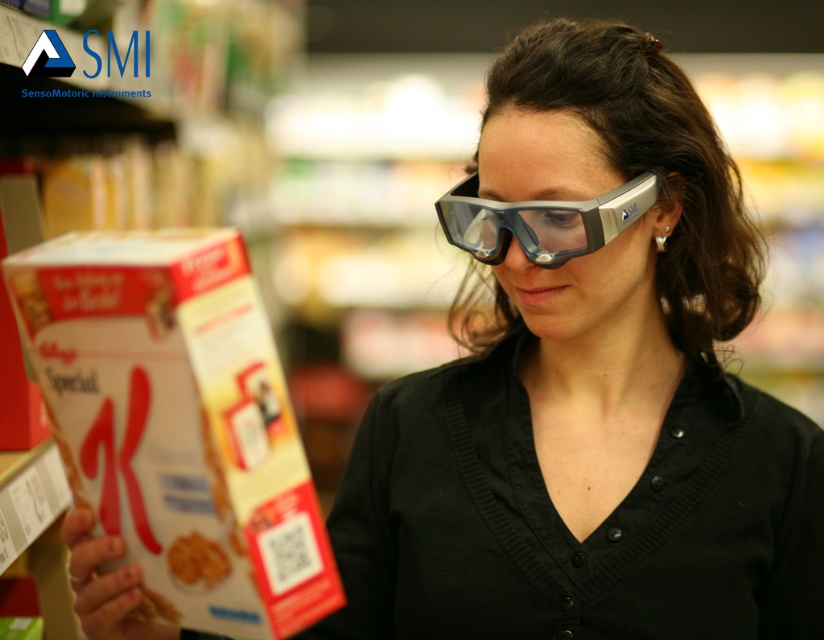
Which is below, white cardboard box at lower left or transparent plastic goggles at center?

Positioned lower is white cardboard box at lower left.

Is point (185, 586) positioned after point (494, 246)?

No, it is not.

Measure the distance between point (284, 627) and camera.

Point (284, 627) and camera are 23.32 inches apart from each other.

I want to click on white cardboard box at lower left, so click(176, 419).

Between transparent plastic goggles at center and golden crispy cereal at lower left, which one appears on the left side from the viewer's perspective?

From the viewer's perspective, golden crispy cereal at lower left appears more on the left side.

Is transparent plastic goggles at center thinner than golden crispy cereal at lower left?

No, transparent plastic goggles at center is not thinner than golden crispy cereal at lower left.

Measure the distance between transparent plastic goggles at center and camera.

They are 32.02 inches apart.

Identify the location of transparent plastic goggles at center. Image resolution: width=824 pixels, height=640 pixels. (542, 220).

Who is taller, white cardboard box at lower left or golden crispy cereal at lower left?

Standing taller between the two is white cardboard box at lower left.

Between white cardboard box at lower left and golden crispy cereal at lower left, which one is positioned higher?

white cardboard box at lower left is above.

Describe the element at coordinates (176, 419) in the screenshot. I see `white cardboard box at lower left` at that location.

Where is `white cardboard box at lower left`? white cardboard box at lower left is located at coordinates (176, 419).